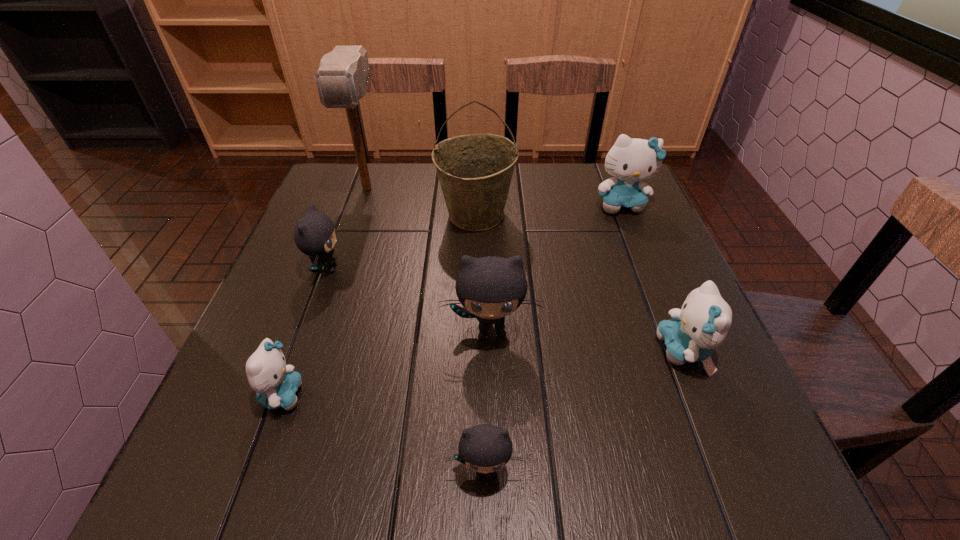
Find the location of a particular element. The width and height of the screenshot is (960, 540). the nearest gray kitten is located at coordinates (484, 448).

Image resolution: width=960 pixels, height=540 pixels. Find the location of `vacant point located 0.260m on the striking face of the mallet`. vacant point located 0.260m on the striking face of the mallet is located at coordinates (339, 275).

Identify the location of vacant region located 0.220m on the front of the seventh shortest object. (474, 309).

Find the location of a particular element. This screenshot has height=540, width=960. free region located on the face of the farthest blue kitten is located at coordinates (657, 293).

This screenshot has width=960, height=540. In order to click on free spot located on the front-facing side of the second farthest gray kitten in this screenshot , I will do `click(492, 393)`.

Find the location of a particular element. Image resolution: width=960 pixels, height=540 pixels. free space located 0.100m on the face of the second smallest blue kitten is located at coordinates (606, 351).

You are a GUI agent. You are given a task and a screenshot of the screen. Output one action in this format:
    pyautogui.click(x=<x>, y=<y>)
    Task: Click on the free location located on the face of the second smallest blue kitten
    Image resolution: width=960 pixels, height=540 pixels.
    Given the screenshot: What is the action you would take?
    click(484, 351)

Find the location of a particular element. The image size is (960, 540). vacant area situated on the face of the second smallest blue kitten is located at coordinates (616, 351).

You are a GUI agent. You are given a task and a screenshot of the screen. Output one action in this format:
    pyautogui.click(x=<x>, y=<y>)
    Task: Click on the blank space located 0.260m on the front-facing side of the second smallest gray kitten
    
    Given the screenshot: What is the action you would take?
    pyautogui.click(x=459, y=268)

You are a GUI agent. You are given a task and a screenshot of the screen. Output one action in this format:
    pyautogui.click(x=<x>, y=<y>)
    Task: Click on the vacant space located on the face of the leftmost blue kitten
    
    Given the screenshot: What is the action you would take?
    pyautogui.click(x=442, y=395)